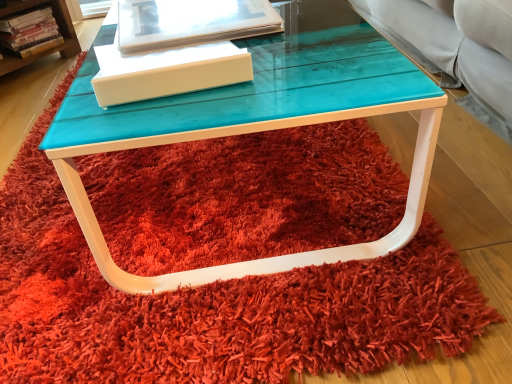
Question: In terms of height, does translucent plastic book at upper center, acting as the second book starting from the back, look taller or shorter compared to white matte box at center?

Choices:
 (A) tall
 (B) short

Answer: (A)

Question: Is point tap(228, 21) closer or farther from the camera than point tap(229, 64)?

Choices:
 (A) closer
 (B) farther

Answer: (B)

Question: Which object is positioned closest to the white matte box at center?

Choices:
 (A) hardcover book at left, placed as the 1th book when sorted from top to bottom
 (B) turquoise glossy table at center
 (C) translucent plastic book at upper center, arranged as the 1th book when viewed from the right

Answer: (B)

Question: Estimate the real-world distances between objects in this image. Which object is farther from the turquoise glossy table at center?

Choices:
 (A) translucent plastic book at upper center, the second book viewed from the top
 (B) hardcover book at left, which appears as the second book when viewed from the front
 (C) white matte box at center

Answer: (B)